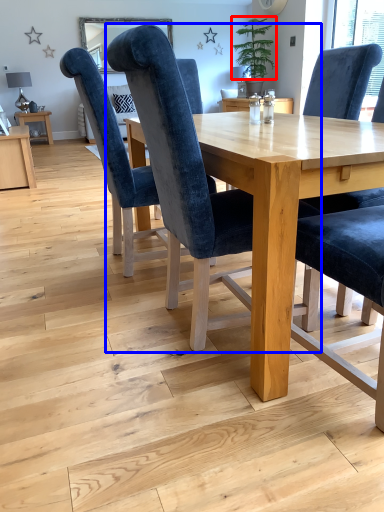
Question: Which of the following is the farthest to the observer, plant (highlighted by a red box) or chair (highlighted by a blue box)?

Choices:
 (A) plant
 (B) chair

Answer: (A)